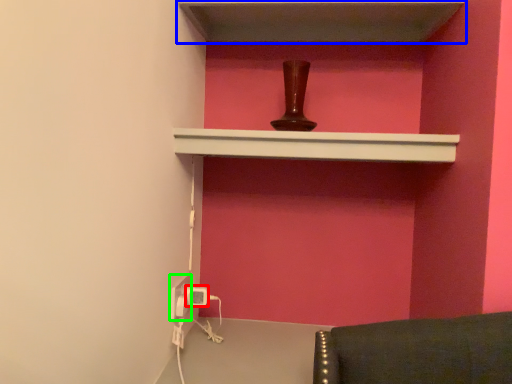
Question: Which is nearer to the electric outlet (highlighted by a red box)? shelf (highlighted by a blue box) or electric outlet (highlighted by a green box).

Choices:
 (A) shelf
 (B) electric outlet

Answer: (B)